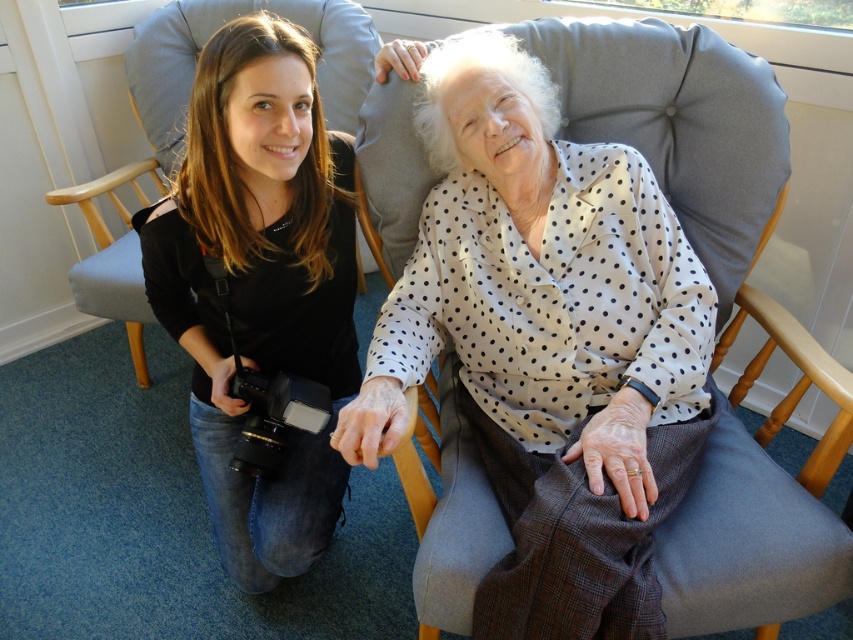
You are a photographer standing in the room and want to take a photo of the white dotted shirt at upper center and the gray fabric rocking chair at left. Which object is closer to the camera?

The white dotted shirt at upper center is closer to the camera because it is in front of the gray fabric rocking chair at left.